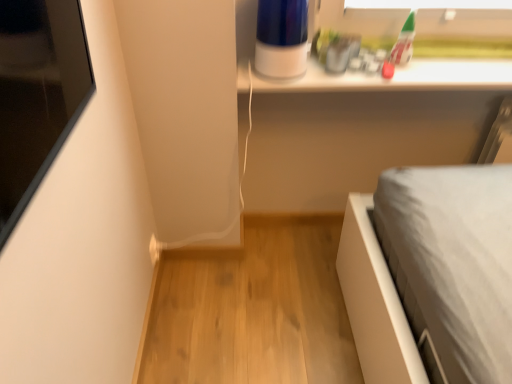
Where is `white glossy shelf at upper center`? The width and height of the screenshot is (512, 384). white glossy shelf at upper center is located at coordinates (392, 78).

The height and width of the screenshot is (384, 512). What do you see at coordinates (392, 78) in the screenshot? I see `white glossy shelf at upper center` at bounding box center [392, 78].

Where is `white glossy shelf at upper center`? The image size is (512, 384). white glossy shelf at upper center is located at coordinates (392, 78).